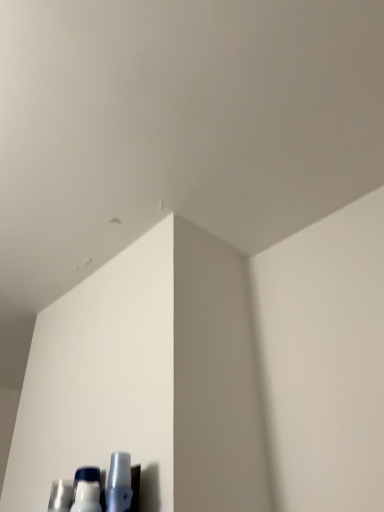
What do you see at coordinates (119, 484) in the screenshot? I see `transparent plastic bottle at lower center` at bounding box center [119, 484].

The height and width of the screenshot is (512, 384). In order to click on transparent plastic bottle at lower center in this screenshot , I will do `click(119, 484)`.

The width and height of the screenshot is (384, 512). Find the location of `transparent plastic bottle at lower center`. transparent plastic bottle at lower center is located at coordinates (119, 484).